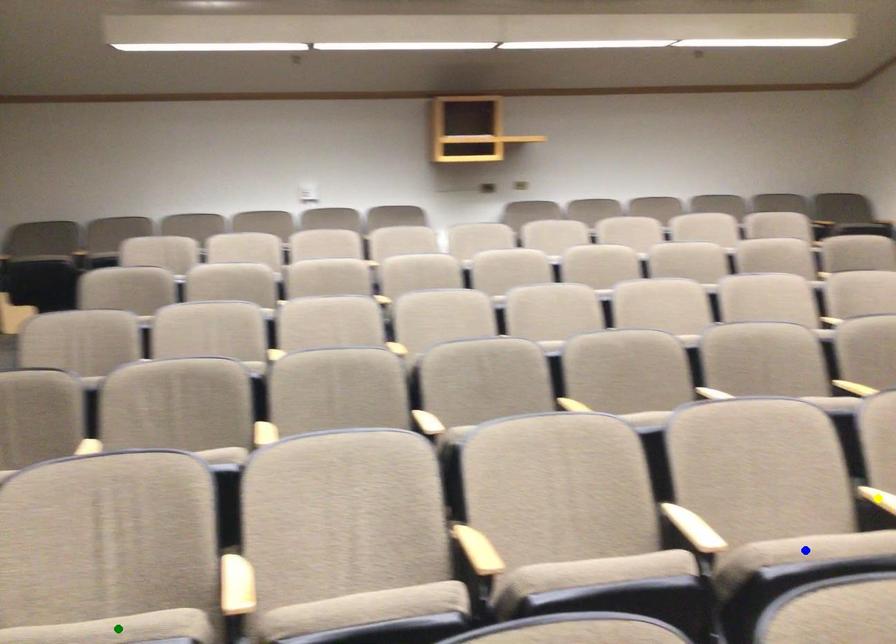
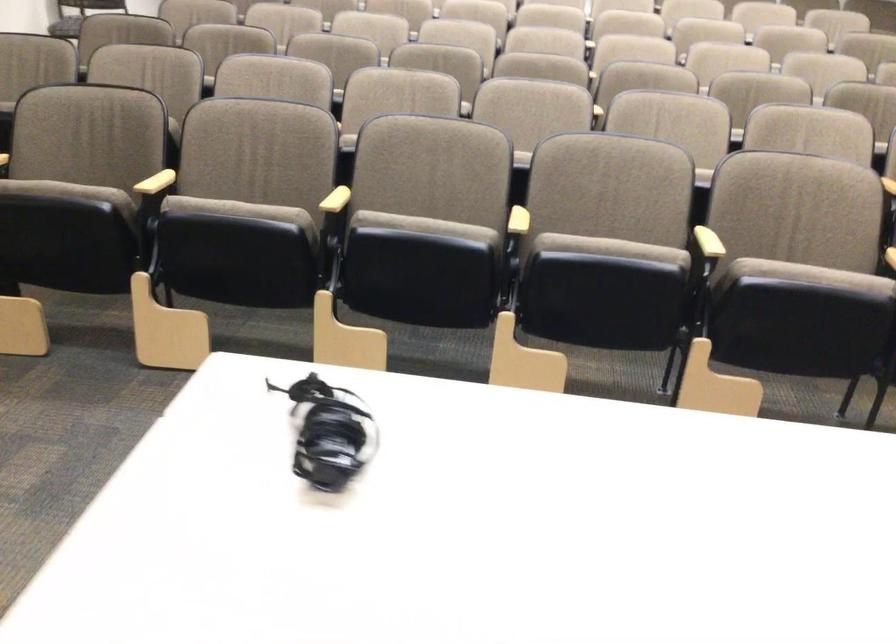
I am providing you with two images of the same scene from different viewpoints. Three points are marked in image1. Which point corresponds to a part or object that is occluded in image2?In image1, three points are marked. Which of them correspond to a part or object that is occluded in image2?Among the three points shown in image1, which one corresponds to a part or object that is no longer visible due to occlusion in image2?

yellow point, blue point, green point cannot be seen in image2.